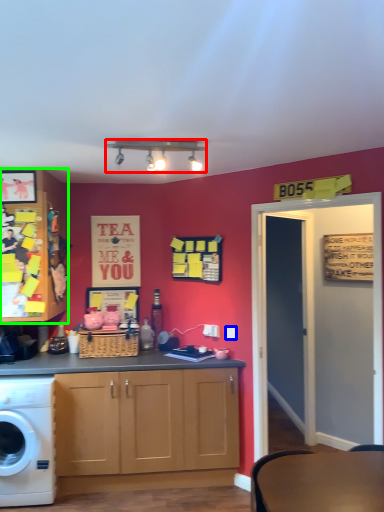
Question: Considering the real-world distances, which object is farthest from lamp (highlighted by a red box)? power outlet (highlighted by a blue box) or cabinetry (highlighted by a green box)?

Choices:
 (A) power outlet
 (B) cabinetry

Answer: (A)